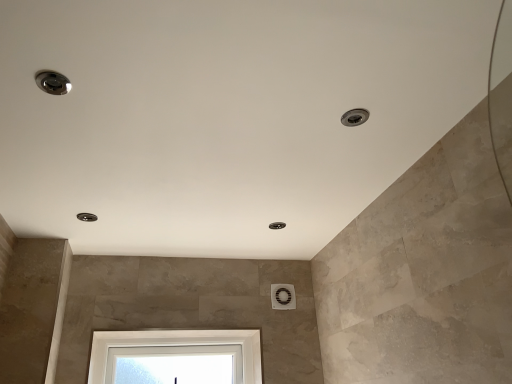
Question: Is matte silver droplight at upper left, the 1th droplight ordered from the bottom, oriented away from satin nickel droplight at upper right, which appears as the first droplight when viewed from the right?

Choices:
 (A) no
 (B) yes

Answer: (A)

Question: Considering the relative positions of matte silver droplight at upper left, the 1th droplight from the back, and satin nickel droplight at upper right, which ranks as the 2th droplight in front-to-back order, in the image provided, is matte silver droplight at upper left, the 1th droplight from the back, behind satin nickel droplight at upper right, which ranks as the 2th droplight in front-to-back order,?

Choices:
 (A) no
 (B) yes

Answer: (B)

Question: From the image's perspective, does matte silver droplight at upper left, the 1th droplight from the back, appear lower than satin nickel droplight at upper right, which appears as the second droplight when viewed from the back?

Choices:
 (A) no
 (B) yes

Answer: (B)

Question: Are matte silver droplight at upper left, which is the 3th droplight in right-to-left order, and satin nickel droplight at upper right, which ranks as the second droplight in bottom-to-top order, located far from each other?

Choices:
 (A) no
 (B) yes

Answer: (B)

Question: Is matte silver droplight at upper left, the 1th droplight from the back, closer to camera compared to satin nickel droplight at upper right, which appears as the 3th droplight when viewed from the left?

Choices:
 (A) yes
 (B) no

Answer: (B)

Question: Is satin nickel droplight at upper right, which ranks as the 2th droplight in front-to-back order, to the left or to the right of satin nickel droplight at upper left, the first droplight viewed from the front, in the image?

Choices:
 (A) right
 (B) left

Answer: (A)

Question: Is satin nickel droplight at upper right, which appears as the first droplight when viewed from the right, in front of or behind satin nickel droplight at upper left, the 2th droplight positioned from the right, in the image?

Choices:
 (A) front
 (B) behind

Answer: (B)

Question: From the image's perspective, is satin nickel droplight at upper right, which appears as the first droplight when viewed from the right, located above or below satin nickel droplight at upper left, the 2th droplight positioned from the right?

Choices:
 (A) above
 (B) below

Answer: (B)

Question: Looking at the image, does satin nickel droplight at upper right, the second droplight positioned from the top, seem bigger or smaller compared to satin nickel droplight at upper left, placed as the third droplight when sorted from bottom to top?

Choices:
 (A) small
 (B) big

Answer: (A)

Question: In the image, is matte silver droplight at upper left, the 3th droplight viewed from the front, positioned in front of or behind satin nickel droplight at upper left, acting as the second droplight starting from the left?

Choices:
 (A) behind
 (B) front

Answer: (A)

Question: From a real-world perspective, is matte silver droplight at upper left, the 3th droplight viewed from the front, physically located above or below satin nickel droplight at upper left, the first droplight viewed from the front?

Choices:
 (A) above
 (B) below

Answer: (A)

Question: Does point (87, 218) appear closer or farther from the camera than point (59, 86)?

Choices:
 (A) farther
 (B) closer

Answer: (A)

Question: Would you say matte silver droplight at upper left, the 3th droplight viewed from the front, is inside or outside satin nickel droplight at upper left, acting as the second droplight starting from the left?

Choices:
 (A) outside
 (B) inside

Answer: (A)

Question: Is satin nickel droplight at upper right, which appears as the first droplight when viewed from the right, inside or outside of matte silver droplight at upper left, the 3th droplight viewed from the front?

Choices:
 (A) inside
 (B) outside

Answer: (B)

Question: Considering the positions of satin nickel droplight at upper right, which appears as the first droplight when viewed from the right, and matte silver droplight at upper left, the 3th droplight viewed from the front, in the image, is satin nickel droplight at upper right, which appears as the first droplight when viewed from the right, bigger or smaller than matte silver droplight at upper left, the 3th droplight viewed from the front,?

Choices:
 (A) small
 (B) big

Answer: (A)